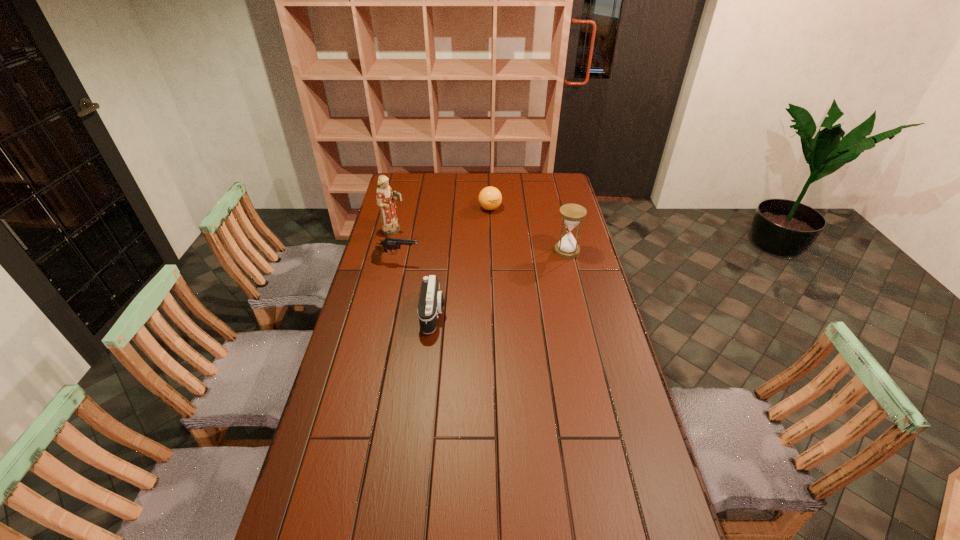
Where is `vacant region between the nearest object and the tallest object`? vacant region between the nearest object and the tallest object is located at coordinates (414, 273).

This screenshot has width=960, height=540. I want to click on vacant region between the fourth farthest object and the fourth shortest object, so click(x=481, y=256).

The image size is (960, 540). In order to click on free space between the second object from right to left and the nearest object in this screenshot , I will do `click(462, 261)`.

I want to click on empty space between the nearest object and the rightmost object, so click(500, 282).

The height and width of the screenshot is (540, 960). Find the location of `vacant region between the tallest object and the camera`. vacant region between the tallest object and the camera is located at coordinates (414, 273).

Locate an element on the screen. Image resolution: width=960 pixels, height=540 pixels. empty space between the farthest object and the camera is located at coordinates (462, 261).

Find the location of a particular element. The height and width of the screenshot is (540, 960). vacant point located between the second nearest object and the nearest object is located at coordinates (415, 288).

This screenshot has height=540, width=960. Identify the location of the third closest object to the tallest object. (431, 302).

Locate which object is the closest to the third object from right to left. Please provide its 2D coordinates. Your answer should be formatted as a tuple, i.e. [(x, y)], where the tuple contains the x and y coordinates of a point satisfying the conditions above.

[(389, 243)]

This screenshot has height=540, width=960. What are the coordinates of `free spot that satisfies the following two spatial constraints: 1. on the back side of the farthest object; 2. on the left side of the figurine` in the screenshot? It's located at (400, 208).